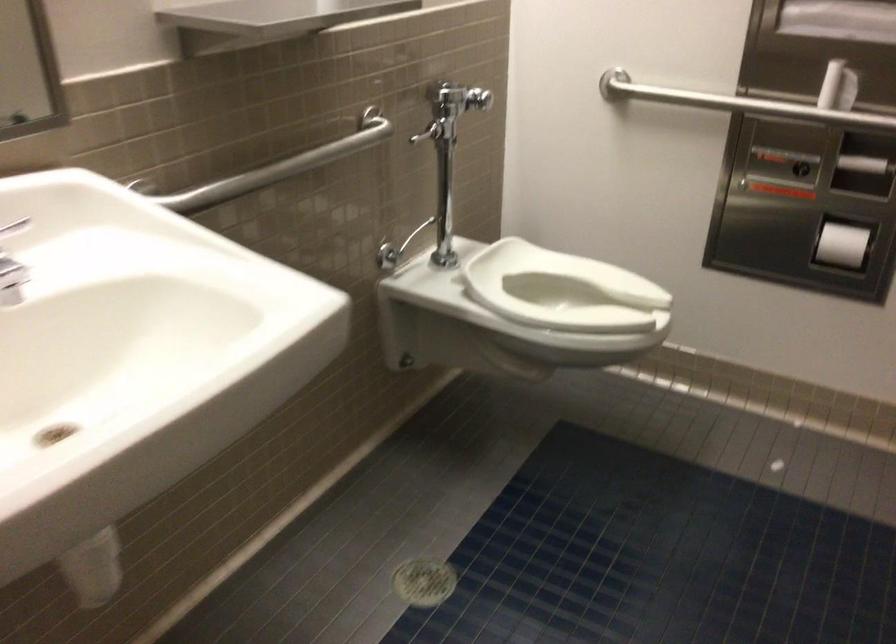
Image resolution: width=896 pixels, height=644 pixels. Describe the element at coordinates (12, 259) in the screenshot. I see `a faucet handle` at that location.